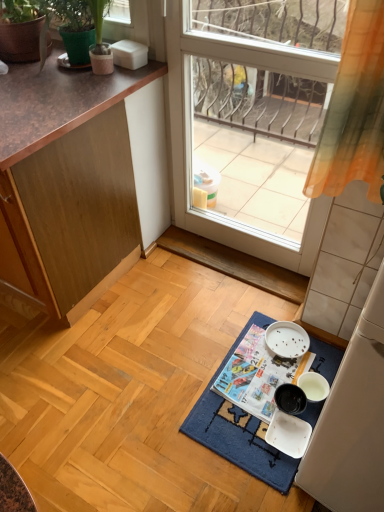
The width and height of the screenshot is (384, 512). In order to click on vacant space in front of white plastic bowl at lower right in this screenshot , I will do `click(280, 471)`.